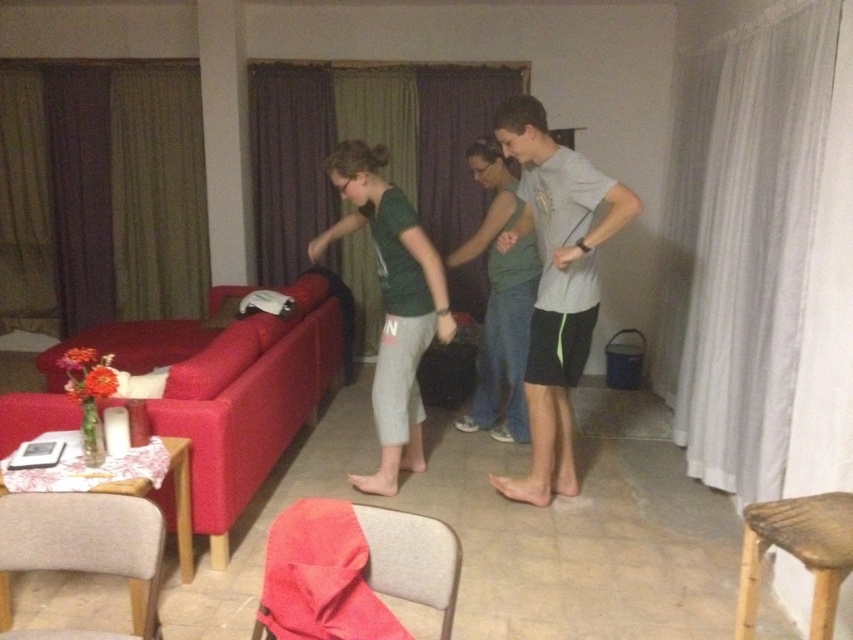
Question: Which object is closer to the camera taking this photo?

Choices:
 (A) bamboo stool at lower right
 (B) green matte shirt at center

Answer: (A)

Question: Considering the real-world distances, which object is closest to the matte red couch at left?

Choices:
 (A) matte green tank top at center
 (B) gray matte t-shirt at center
 (C) bamboo stool at lower right

Answer: (A)

Question: Does green matte shirt at center have a smaller size compared to matte green tank top at center?

Choices:
 (A) yes
 (B) no

Answer: (B)

Question: Is green cotton shirt at center positioned before matte green tank top at center?

Choices:
 (A) yes
 (B) no

Answer: (A)

Question: Among these points, which one is farthest from the camera?

Choices:
 (A) pyautogui.click(x=376, y=154)
 (B) pyautogui.click(x=308, y=362)
 (C) pyautogui.click(x=567, y=337)
 (D) pyautogui.click(x=753, y=588)

Answer: (B)

Question: Can you confirm if gray matte t-shirt at center is wider than green matte shirt at center?

Choices:
 (A) yes
 (B) no

Answer: (B)